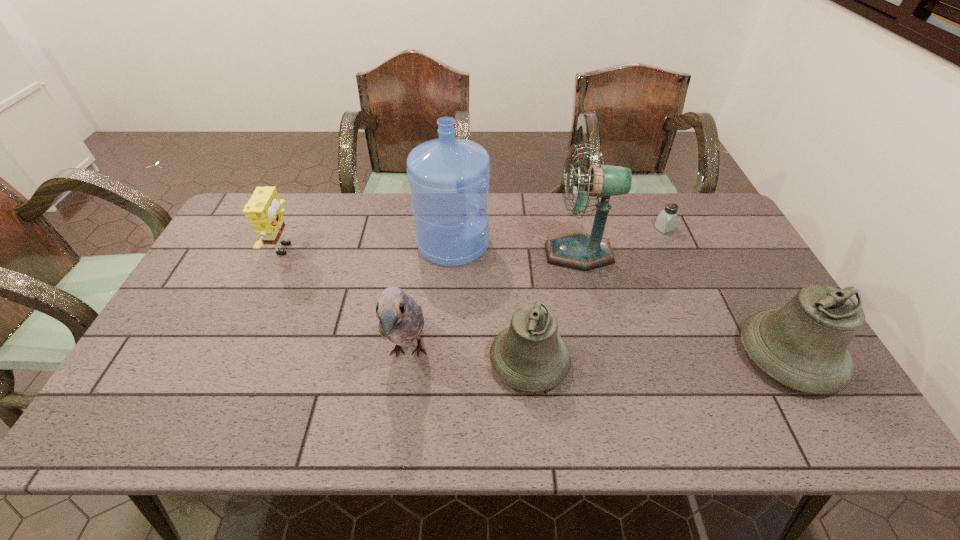
At what (x,y) coordinates should I click in order to perform the action: click on fan at the far edge. Please return your answer as a coordinate pair (x, y). The image size is (960, 540). Looking at the image, I should click on tap(579, 251).

Identify the location of parrot located at the near edge. (401, 320).

Find the location of a particular element. object that is at the right edge is located at coordinates (803, 345).

Identify the location of object that is at the near right corner. (803, 345).

Locate an element on the screen. vacant space at the far edge of the desktop is located at coordinates (364, 213).

The width and height of the screenshot is (960, 540). In order to click on vacant space at the near edge of the desktop in this screenshot , I will do `click(282, 371)`.

The width and height of the screenshot is (960, 540). In the image, there is a desktop. Identify the location of vacant region at the left edge. (189, 299).

Identify the location of free spot at the right edge of the desktop. The width and height of the screenshot is (960, 540). (692, 246).

Where is `vacant region at the far left corner`? The width and height of the screenshot is (960, 540). vacant region at the far left corner is located at coordinates (246, 233).

In the image, there is a desktop. Where is `vacant space at the near left corner`? The image size is (960, 540). vacant space at the near left corner is located at coordinates (157, 395).